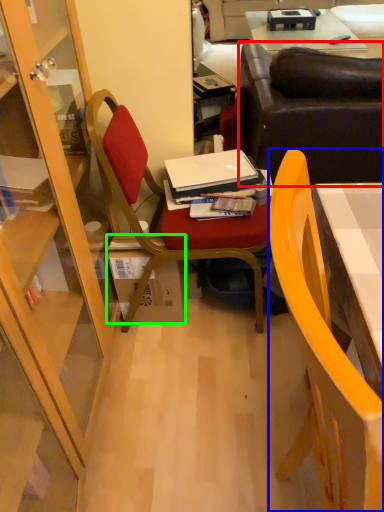
Question: Which object is the farthest from studio couch (highlighted by a red box)? Choose among these: chair (highlighted by a blue box) or box (highlighted by a green box).

Choices:
 (A) chair
 (B) box

Answer: (A)